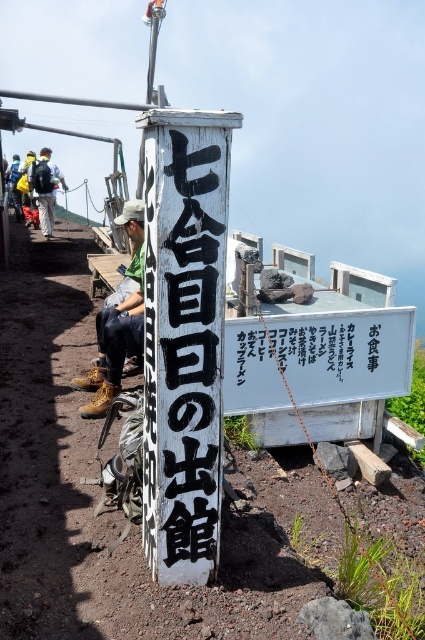
You are standing at the viewpoint and want to locate the black painted wood sign at center. According to the coordinates provided, where should you look?

The black painted wood sign at center is located at point [189,352], which is slightly to the right and above the center of the image.

Based on the photo, you are a hiker who just arrived at this mountain viewpoint. You need to check the items in your matte black backpack at left before proceeding. However, you notice a black painted wood sign at center that might have important information. Which item do you need to access first, the backpack or the sign?

The black painted wood sign at center is located below the matte black backpack at left, so you can access the backpack first without needing to move the sign.